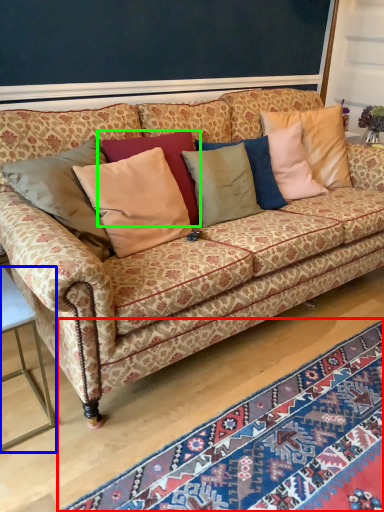
Question: Considering the real-world distances, which object is farthest from mat (highlighted by a red box)? table (highlighted by a blue box) or pillow (highlighted by a green box)?

Choices:
 (A) table
 (B) pillow

Answer: (B)